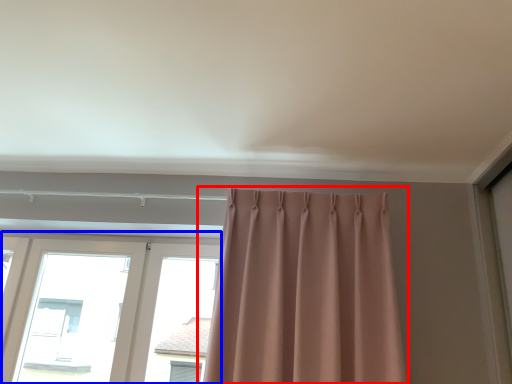
Question: Which object is closer to the camera taking this photo, curtain (highlighted by a red box) or window (highlighted by a blue box)?

Choices:
 (A) curtain
 (B) window

Answer: (A)